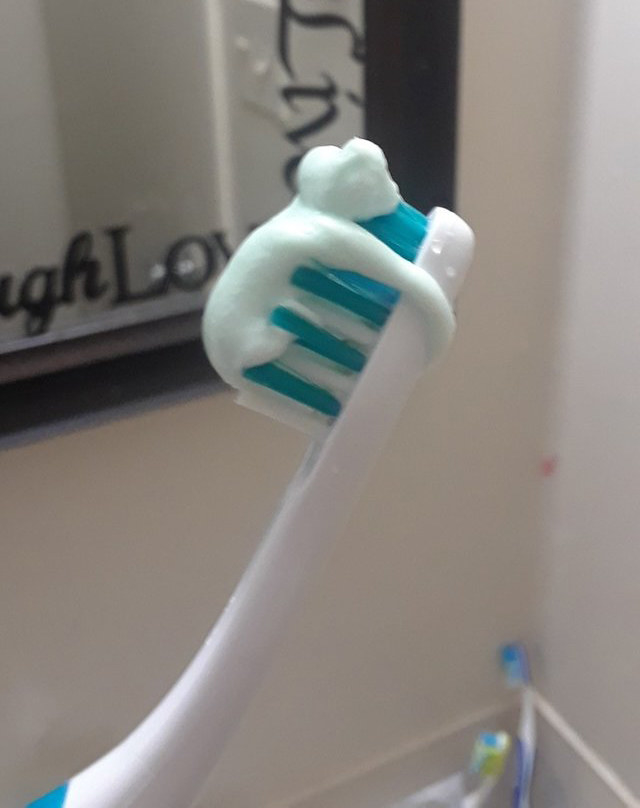
Locate an element on the screen. This screenshot has width=640, height=808. wall is located at coordinates (468, 558).